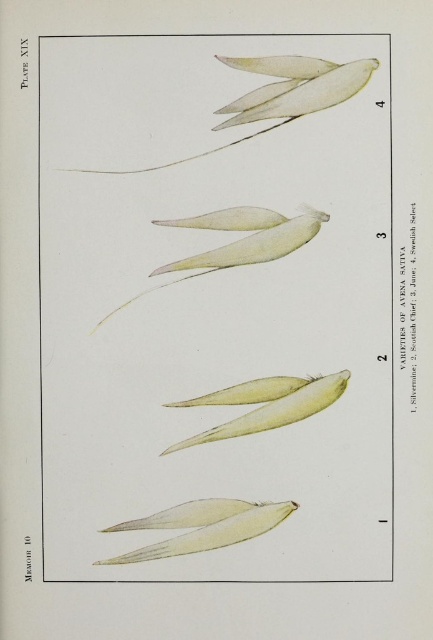
You are an agricultural researcher examining the botanical illustration of oat varieties. You notice a translucent paper like leaf at a specific coordinate. What object is located at point (203, 525)?

The translucent paper like leaf at lower center is located at point (203, 525).